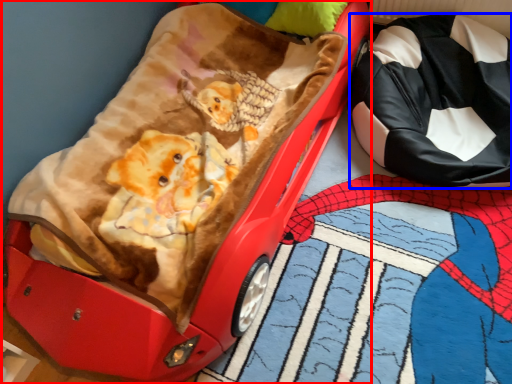
Question: Which object is further to the camera taking this photo, furniture (highlighted by a red box) or pillow (highlighted by a blue box)?

Choices:
 (A) furniture
 (B) pillow

Answer: (B)